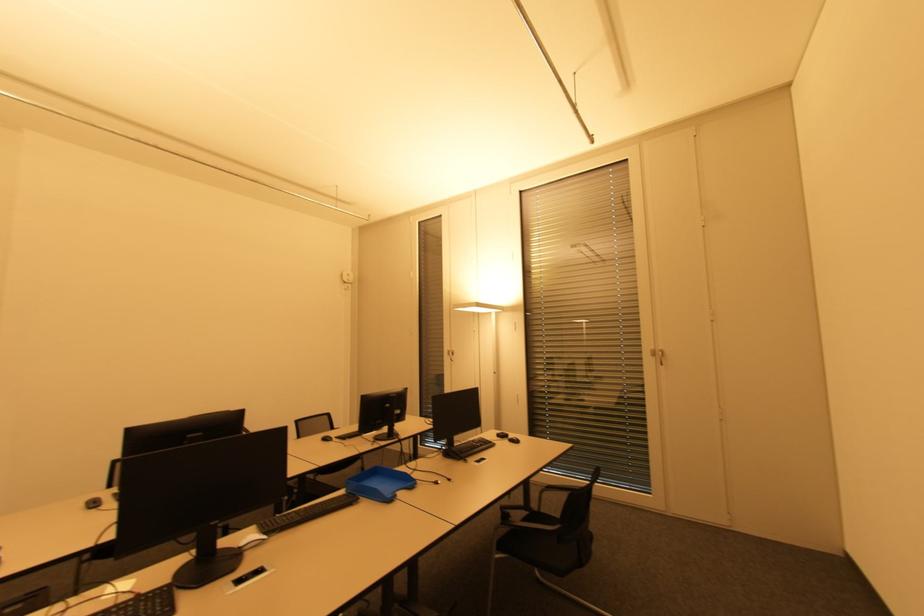
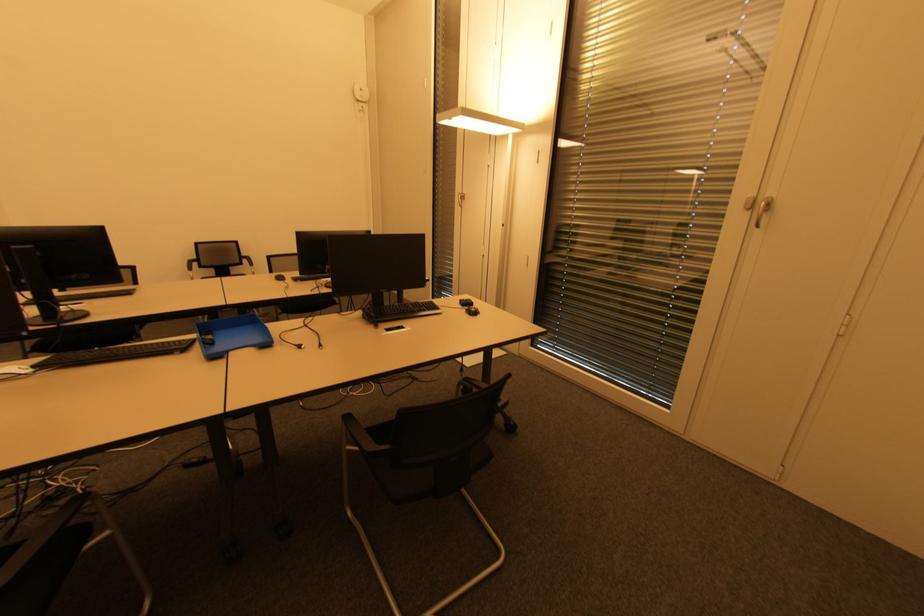
In a continuous first-person perspective shot, in which direction is the camera moving?

The cameraman moved toward right, forward.